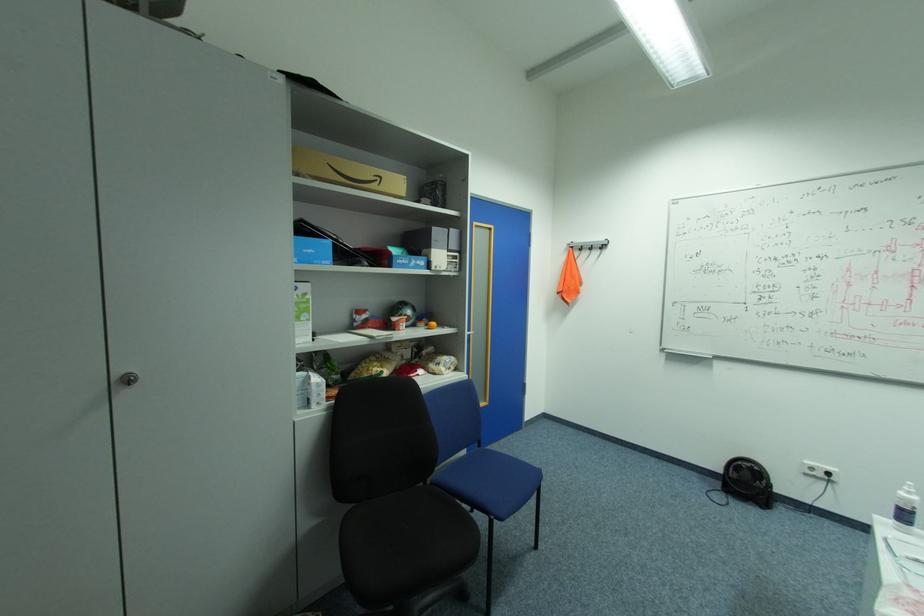
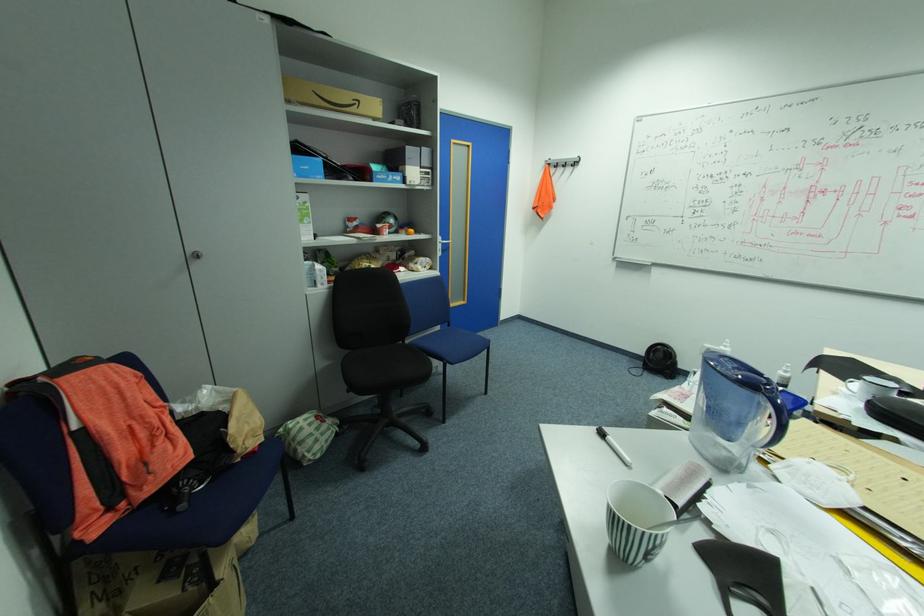
Which direction would the cameraman need to move to produce the second image?

The cameraman moved toward right, backward.